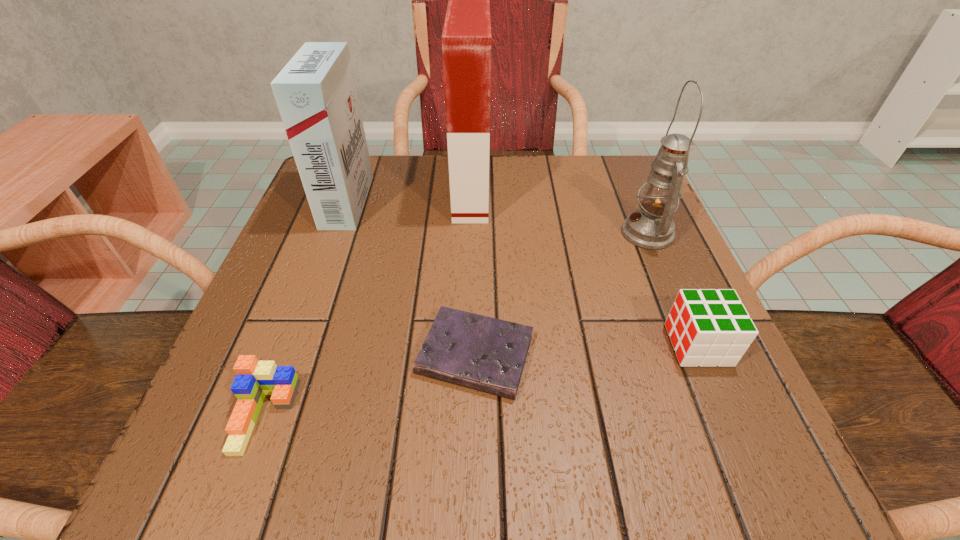
At what (x,y) coordinates should I click in order to perform the action: click on vacant point located on the red face of the fourth tallest object. Please return your answer as a coordinate pair (x, y). The height and width of the screenshot is (540, 960). Looking at the image, I should click on [x=443, y=345].

What are the coordinates of `free space located 0.340m on the red face of the fourth tallest object` in the screenshot? It's located at click(449, 345).

Identify the location of vacant region located 0.170m on the back of the second shortest object. The width and height of the screenshot is (960, 540). (311, 294).

This screenshot has height=540, width=960. I want to click on free location located on the left of the shortest object, so click(x=229, y=355).

Identify the location of oil lamp at the far edge. The image size is (960, 540). (651, 227).

You are a GUI agent. You are given a task and a screenshot of the screen. Output one action in this format:
    pyautogui.click(x=<x>, y=<y>)
    Task: Click on the object present at the near edge
    This screenshot has width=960, height=540.
    Given the screenshot: What is the action you would take?
    pyautogui.click(x=255, y=379)

This screenshot has width=960, height=540. In order to click on cigarette case that is at the left edge in this screenshot , I will do `click(316, 95)`.

Identify the location of Lego that is at the left edge. The image size is (960, 540). (255, 379).

Find the location of `oil lamp present at the right edge`. oil lamp present at the right edge is located at coordinates 651,227.

What are the coordinates of `cube positioned at the right edge` in the screenshot? It's located at (707, 327).